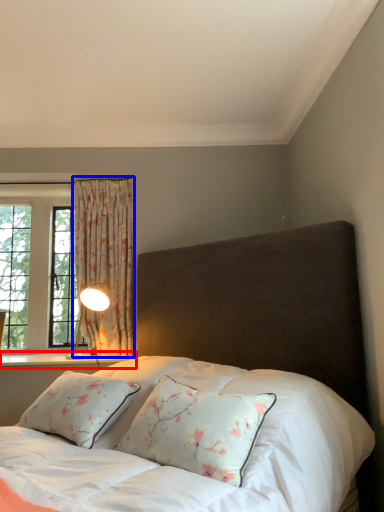
Question: Which object is further to the camera taking this photo, window sill (highlighted by a red box) or curtain (highlighted by a blue box)?

Choices:
 (A) window sill
 (B) curtain

Answer: (B)